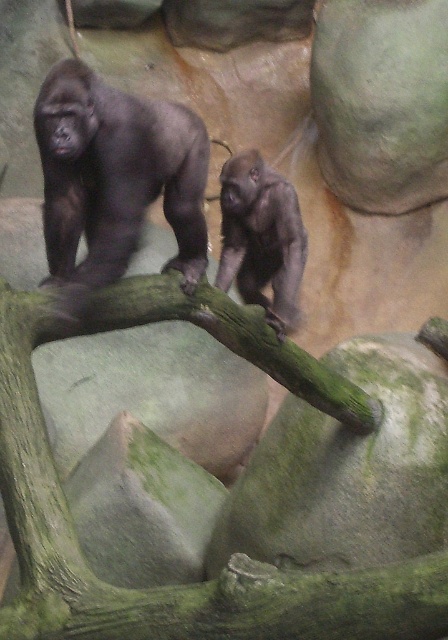
Question: Based on their relative distances, which object is farther from the gray matte gorilla at center?

Choices:
 (A) shiny dark gray gorilla at center
 (B) green rough branch at center

Answer: (B)

Question: Can you confirm if green rough branch at center is positioned to the right of shiny dark gray gorilla at center?

Choices:
 (A) no
 (B) yes

Answer: (B)

Question: Which of the following is the closest to the observer?

Choices:
 (A) (284, 260)
 (B) (27, 429)
 (C) (198, 140)

Answer: (B)

Question: Is shiny dark gray gorilla at center above gray matte gorilla at center?

Choices:
 (A) yes
 (B) no

Answer: (A)

Question: Which point is farther from the camera taking this photo?

Choices:
 (A) (20, 508)
 (B) (280, 300)
 (C) (103, 170)

Answer: (B)

Question: Is shiny dark gray gorilla at center below gray matte gorilla at center?

Choices:
 (A) yes
 (B) no

Answer: (B)